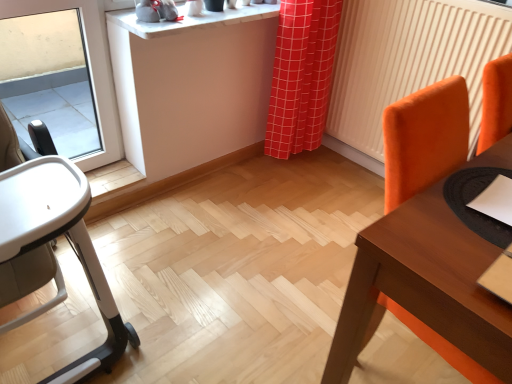
The width and height of the screenshot is (512, 384). Describe the element at coordinates (191, 20) in the screenshot. I see `white marble counter top at upper center` at that location.

Image resolution: width=512 pixels, height=384 pixels. What do you see at coordinates (424, 285) in the screenshot?
I see `wooden table at right` at bounding box center [424, 285].

Image resolution: width=512 pixels, height=384 pixels. I want to click on red checkered curtain at center, so click(x=301, y=75).

Identify the location of radiator positioned vertically above the red checkered curtain at center (from a real-world perspective). Image resolution: width=512 pixels, height=384 pixels. (409, 59).

Are orange fabric radiator at right and red checkered curtain at center far apart?

They are positioned close to each other.

Do you think orange fabric radiator at right is within red checkered curtain at center, or outside of it?

orange fabric radiator at right is spatially situated outside red checkered curtain at center.

Can you confirm if orange fabric radiator at right is positioned to the right of red checkered curtain at center?

Indeed, orange fabric radiator at right is positioned on the right side of red checkered curtain at center.

Consider the image. Which is nearer, (295, 126) or (438, 193)?

Clearly, point (295, 126) is more distant from the camera than point (438, 193).

Is red checkered curtain at center located outside wooden table at right?

That's correct, red checkered curtain at center is outside of wooden table at right.

Is red checkered curtain at center thinner than wooden table at right?

Correct, the width of red checkered curtain at center is less than that of wooden table at right.

Is wooden table at right with red checkered curtain at center?

wooden table at right and red checkered curtain at center are not in contact.

Based on the photo, from the image's perspective, which is above, wooden table at right or red checkered curtain at center?

red checkered curtain at center, from the image's perspective.

In the image, is wooden table at right positioned in front of or behind red checkered curtain at center?

Clearly, wooden table at right is in front of red checkered curtain at center.

From a real-world perspective, is wooden table at right below red checkered curtain at center?

Yes, from a real-world perspective, wooden table at right is beneath red checkered curtain at center.

Is beige fabric highchair at left outside of red checkered curtain at center?

That's correct, beige fabric highchair at left is outside of red checkered curtain at center.

Looking at this image, does beige fabric highchair at left touch red checkered curtain at center?

beige fabric highchair at left is not next to red checkered curtain at center, and they're not touching.

Is red checkered curtain at center at the back of beige fabric highchair at left?

No, beige fabric highchair at left's orientation is not away from red checkered curtain at center.

Between beige fabric highchair at left and red checkered curtain at center, which one has larger width?

beige fabric highchair at left.

Considering the positions of objects orange fabric radiator at right and beige fabric highchair at left in the image provided, who is more to the right, orange fabric radiator at right or beige fabric highchair at left?

From the viewer's perspective, orange fabric radiator at right appears more on the right side.

Considering the sizes of objects orange fabric radiator at right and beige fabric highchair at left in the image provided, who is taller, orange fabric radiator at right or beige fabric highchair at left?

Standing taller between the two is orange fabric radiator at right.

Is point (357, 67) positioned behind point (3, 263)?

Yes, point (357, 67) is behind point (3, 263).

Based on the photo, can you see red checkered curtain at center touching white marble counter top at upper center?

They are not placed beside each other.

Does red checkered curtain at center have a greater height compared to white marble counter top at upper center?

Yes.

Is red checkered curtain at center located outside white marble counter top at upper center?

Yes, red checkered curtain at center is outside of white marble counter top at upper center.

I want to click on counter top located above the wooden table at right (from a real-world perspective), so click(x=191, y=20).

Is wooden table at right shorter than white marble counter top at upper center?

No, wooden table at right is not shorter than white marble counter top at upper center.

Would you say wooden table at right is inside or outside white marble counter top at upper center?

wooden table at right cannot be found inside white marble counter top at upper center.

Can you tell me how much wooden table at right and white marble counter top at upper center differ in facing direction?

There is a 91.1-degree angle between the facing directions of wooden table at right and white marble counter top at upper center.

Find the location of a particular element. This screenshot has width=512, height=384. radiator in front of the red checkered curtain at center is located at coordinates (409, 59).

There is a wooden table at right. Identify the location of curtain above it (from a real-world perspective). (301, 75).

Based on their spatial positions, is beige fabric highchair at left or orange fabric radiator at right further from white marble counter top at upper center?

The object further to white marble counter top at upper center is beige fabric highchair at left.

When comparing their distances from red checkered curtain at center, does beige fabric highchair at left or white marble counter top at upper center seem closer?

white marble counter top at upper center.

Looking at the image, which one is located closer to orange fabric radiator at right, wooden table at right or red checkered curtain at center?

red checkered curtain at center is positioned closer to the anchor orange fabric radiator at right.

When comparing their distances from red checkered curtain at center, does wooden table at right or white marble counter top at upper center seem further?

wooden table at right is further to red checkered curtain at center.

From the picture: Which object lies further to the anchor point beige fabric highchair at left, wooden table at right or red checkered curtain at center?

red checkered curtain at center is positioned further to the anchor beige fabric highchair at left.

When comparing their distances from orange fabric radiator at right, does red checkered curtain at center or white marble counter top at upper center seem further?

Among the two, white marble counter top at upper center is located further to orange fabric radiator at right.

Consider the image. Considering their positions, is red checkered curtain at center positioned closer to orange fabric radiator at right than beige fabric highchair at left?

The object closer to orange fabric radiator at right is red checkered curtain at center.

Based on their spatial positions, is wooden table at right or white marble counter top at upper center further from beige fabric highchair at left?

white marble counter top at upper center lies further to beige fabric highchair at left than the other object.

The image size is (512, 384). I want to click on curtain between white marble counter top at upper center and orange fabric radiator at right in the horizontal direction, so click(x=301, y=75).

The width and height of the screenshot is (512, 384). What are the coordinates of `counter top located between beige fabric highchair at left and wooden table at right in the left-right direction` in the screenshot? It's located at (191, 20).

Identify the location of counter top located between wooden table at right and red checkered curtain at center in the depth direction. The height and width of the screenshot is (384, 512). (191, 20).

Identify the location of radiator between wooden table at right and red checkered curtain at center in the front-back direction. The height and width of the screenshot is (384, 512). (409, 59).